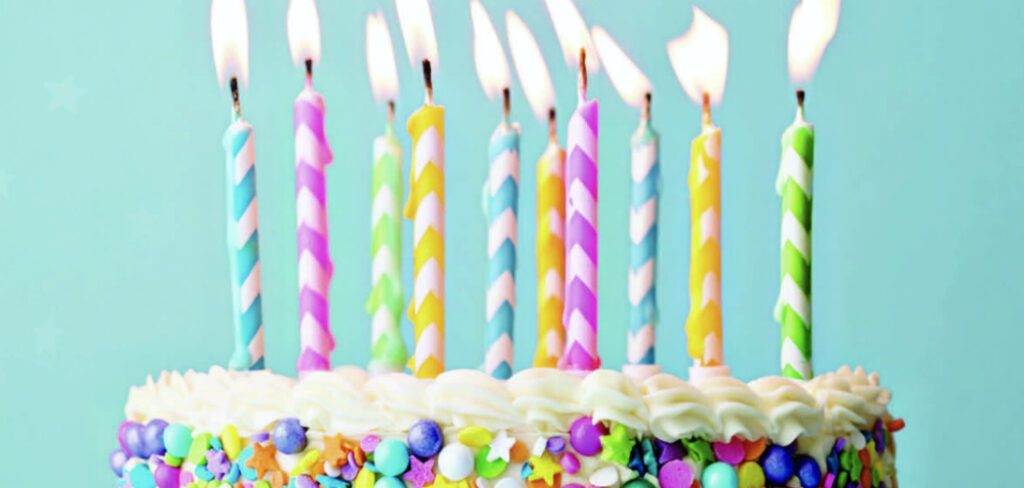
The image size is (1024, 488). I want to click on lit birthday candles, so click(225, 37), click(303, 39), click(380, 54), click(414, 40), click(486, 59), click(539, 71), click(577, 32), click(622, 68), click(700, 62), click(809, 37).